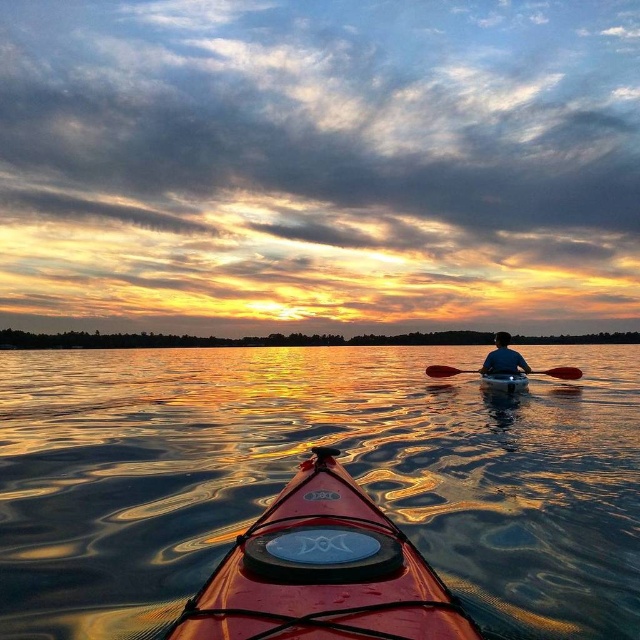
Which is behind, point (509, 356) or point (488, 376)?

Positioned behind is point (488, 376).

Locate an element on the screen. The height and width of the screenshot is (640, 640). blue fabric person at center is located at coordinates (502, 356).

Does blue fabric person at center appear on the right side of black rubber paddle at center?

In fact, blue fabric person at center is to the left of black rubber paddle at center.

Can you confirm if blue fabric person at center is positioned below black rubber paddle at center?

No.

Measure the distance between blue fabric person at center and camera.

blue fabric person at center and camera are 14.34 meters apart from each other.

The image size is (640, 640). What are the coordinates of `blue fabric person at center` in the screenshot? It's located at (502, 356).

Does glossy water at center have a greater height compared to shiny red kayak at center?

Yes, glossy water at center is taller than shiny red kayak at center.

Can you confirm if glossy water at center is positioned to the right of shiny red kayak at center?

In fact, glossy water at center is to the left of shiny red kayak at center.

Who is more distant from viewer, (467, 422) or (220, 586)?

The point (467, 422) is behind.

The image size is (640, 640). What are the coordinates of `glossy water at center` in the screenshot? It's located at pos(296,468).